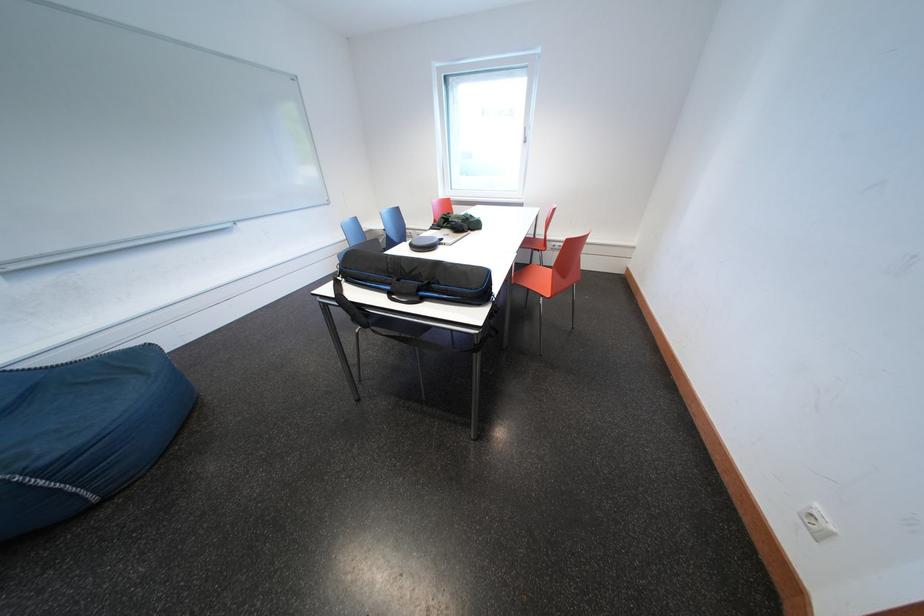
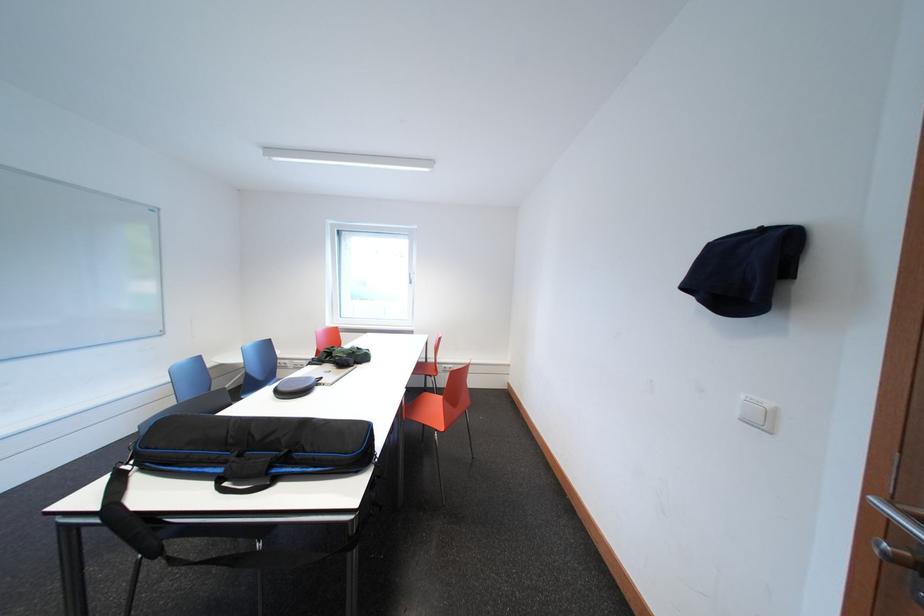
First-person continuous shooting, in which direction is the camera rotating?

The rotation direction of the camera is right-up.